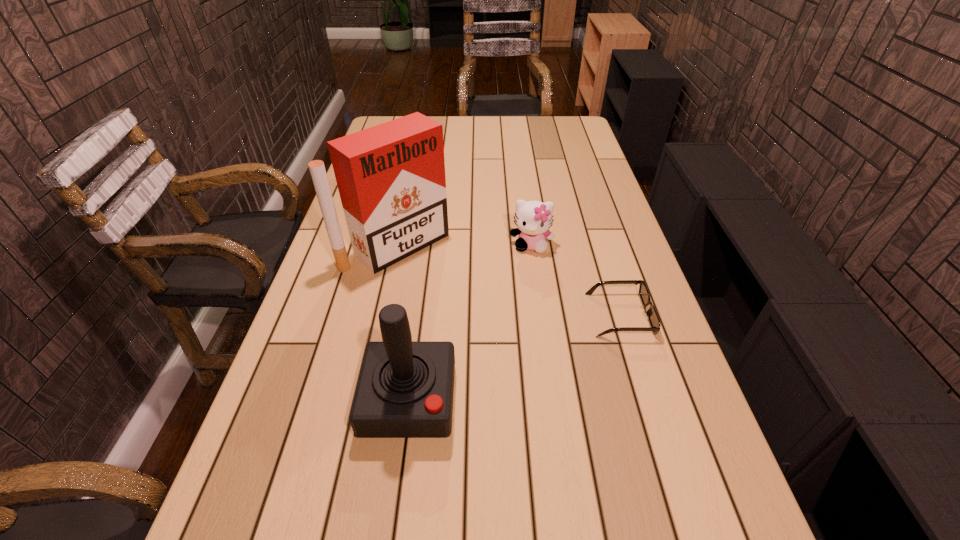
Locate an element on the screen. The height and width of the screenshot is (540, 960). the third shortest object is located at coordinates (405, 389).

Where is `the nearest object`? The height and width of the screenshot is (540, 960). the nearest object is located at coordinates (405, 389).

You are a GUI agent. You are given a task and a screenshot of the screen. Output one action in this format:
    pyautogui.click(x=<x>, y=<y>)
    Task: Click on the sunglasses
    Image resolution: width=960 pixels, height=540 pixels.
    Given the screenshot: What is the action you would take?
    pyautogui.click(x=651, y=313)

The image size is (960, 540). What are the coordinates of `the third farthest object` in the screenshot? It's located at (651, 313).

Locate an element on the screen. The image size is (960, 540). kitten is located at coordinates (533, 218).

This screenshot has width=960, height=540. I want to click on the second shortest object, so click(x=533, y=218).

Locate an element on the screen. This screenshot has width=960, height=540. cigarette case is located at coordinates (391, 179).

Where is `vacant position located on the base of the nearest object`? The image size is (960, 540). vacant position located on the base of the nearest object is located at coordinates (395, 505).

Find the location of a particular element. free space located on the front-facing side of the third object from left to right is located at coordinates (522, 342).

Locate an element on the screen. The height and width of the screenshot is (540, 960). vacant space located 0.100m on the front-facing side of the third object from left to right is located at coordinates (528, 278).